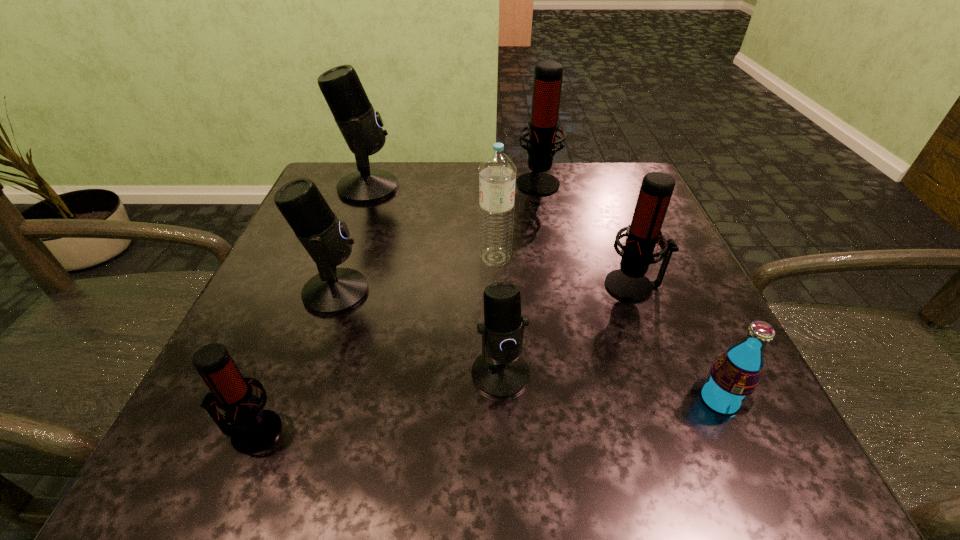
Locate an element on the screen. free location that satisfies the following two spatial constraints: 1. on the stand of the biggest black microphone; 2. on the left side of the soda is located at coordinates (291, 400).

The image size is (960, 540). I want to click on blank area in the image that satisfies the following two spatial constraints: 1. on the front side of the biggest red microphone; 2. on the stand of the second farthest black microphone, so click(559, 292).

At what (x,y) coordinates should I click in order to perform the action: click on free space that satisfies the following two spatial constraints: 1. on the front side of the soda; 2. on the left side of the second red microphone from left to right. Please return your answer as a coordinate pair (x, y). The width and height of the screenshot is (960, 540). Looking at the image, I should click on (579, 400).